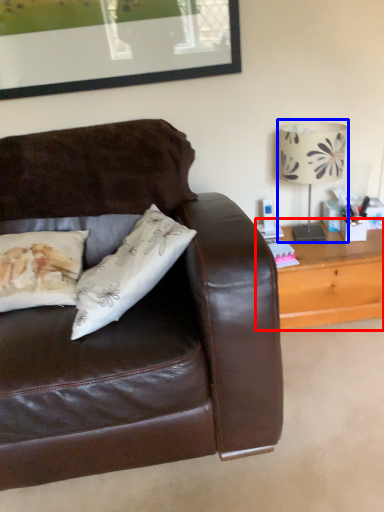
Question: Among these objects, which one is farthest to the camera, table (highlighted by a red box) or table lamp (highlighted by a blue box)?

Choices:
 (A) table
 (B) table lamp

Answer: (A)